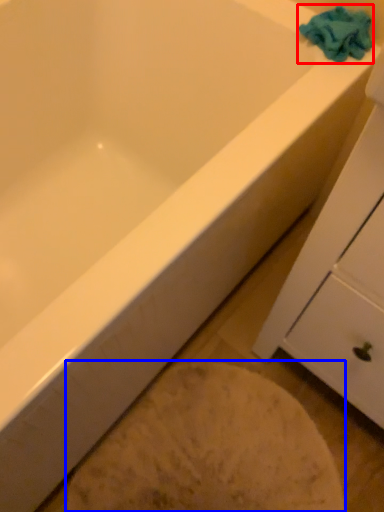
Question: Which of the following is the farthest to the observer, bath towel (highlighted by a red box) or porcelain (highlighted by a blue box)?

Choices:
 (A) bath towel
 (B) porcelain

Answer: (A)